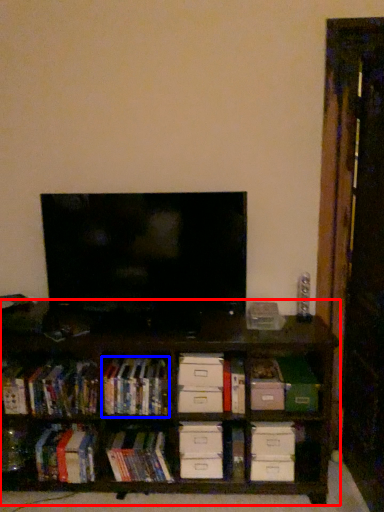
Question: Which object is further to the camera taking this photo, shelf (highlighted by a red box) or book (highlighted by a blue box)?

Choices:
 (A) shelf
 (B) book

Answer: (B)